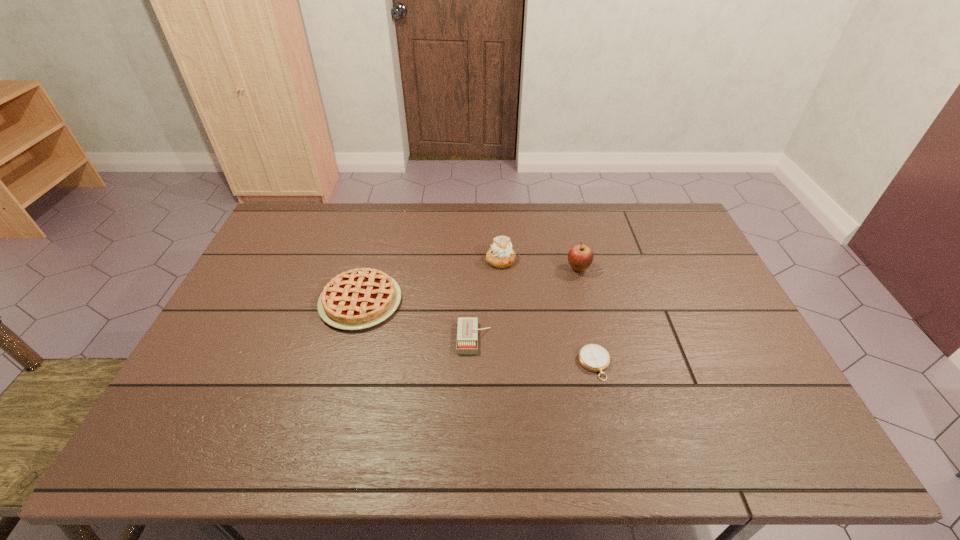
In order to click on vacant space positioned 0.330m on the left of the compass in this screenshot , I will do 453,364.

In the image, there is a desktop. At what (x,y) coordinates should I click in order to perform the action: click on vacant space at the far edge. Please return your answer as a coordinate pair (x, y). Looking at the image, I should click on (470, 206).

Locate an element on the screen. This screenshot has width=960, height=540. vacant space at the near edge of the desktop is located at coordinates (702, 428).

The height and width of the screenshot is (540, 960). In the image, there is a desktop. Find the location of `vacant space at the left edge`. vacant space at the left edge is located at coordinates (263, 250).

At what (x,y) coordinates should I click in order to perform the action: click on vacant area at the right edge of the desktop. Please return your answer as a coordinate pair (x, y). The height and width of the screenshot is (540, 960). Looking at the image, I should click on (780, 407).

Identify the location of vacant area that lies between the pastry and the apple. (540, 265).

Find the location of `empty space that is in between the matchbox and the compass`. empty space that is in between the matchbox and the compass is located at coordinates (535, 351).

At what (x,y) coordinates should I click in order to perform the action: click on unoccupied area between the apple and the leftmost object. Please return your answer as a coordinate pair (x, y). The width and height of the screenshot is (960, 540). Looking at the image, I should click on (469, 285).

Locate an element on the screen. The image size is (960, 540). vacant space that's between the leftmost object and the apple is located at coordinates (469, 285).

You are a GUI agent. You are given a task and a screenshot of the screen. Output one action in this format:
    pyautogui.click(x=<x>, y=<y>)
    Task: Click on the free spot between the third shortest object and the second shortest object
    
    Given the screenshot: What is the action you would take?
    pyautogui.click(x=418, y=320)